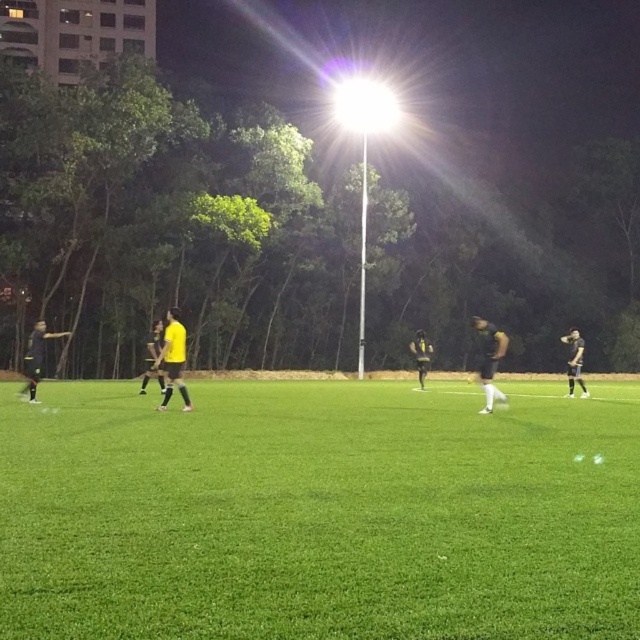
Question: From the image, what is the correct spatial relationship of black matte soccer player at right in relation to black matte jersey at center?

Choices:
 (A) below
 (B) above

Answer: (B)

Question: Is yellow matte jersey at center positioned before black matte jersey at center?

Choices:
 (A) no
 (B) yes

Answer: (B)

Question: Among these objects, which one is nearest to the camera?

Choices:
 (A) black matte jersey at center
 (B) green artificial turf at center
 (C) yellow matte jersey at center
 (D) black matte soccer player at left

Answer: (B)

Question: Does black matte soccer player at left appear on the right side of yellow jersey at center?

Choices:
 (A) no
 (B) yes

Answer: (A)

Question: Among these points, which one is nearest to the camera?

Choices:
 (A) (579, 365)
 (B) (157, 332)
 (C) (36, 324)

Answer: (B)

Question: Among these points, which one is farthest from the camera?

Choices:
 (A) (496, 368)
 (B) (144, 376)
 (C) (566, 369)
 (D) (168, 381)

Answer: (C)